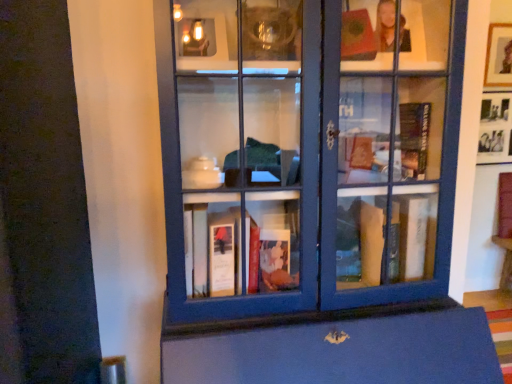
Question: Is wooden picture frame at upper right, the 1th picture frame in the top-to-bottom sequence, looking in the opposite direction of black matte picture frame at upper right, arranged as the first picture frame when ordered from the bottom?

Choices:
 (A) yes
 (B) no

Answer: (B)

Question: Would you say wooden picture frame at upper right, which is counted as the second picture frame, starting from the bottom, is outside black matte picture frame at upper right, arranged as the first picture frame when ordered from the bottom?

Choices:
 (A) yes
 (B) no

Answer: (A)

Question: From the image's perspective, would you say wooden picture frame at upper right, which is counted as the second picture frame, starting from the bottom, is positioned over black matte picture frame at upper right, arranged as the first picture frame when ordered from the bottom?

Choices:
 (A) no
 (B) yes

Answer: (B)

Question: Considering the relative sizes of wooden picture frame at upper right, which is counted as the second picture frame, starting from the bottom, and black matte picture frame at upper right, arranged as the first picture frame when ordered from the bottom, in the image provided, is wooden picture frame at upper right, which is counted as the second picture frame, starting from the bottom, bigger than black matte picture frame at upper right, arranged as the first picture frame when ordered from the bottom,?

Choices:
 (A) yes
 (B) no

Answer: (B)

Question: Is wooden picture frame at upper right, the 1th picture frame in the top-to-bottom sequence, at the left side of black matte picture frame at upper right, arranged as the first picture frame when ordered from the bottom?

Choices:
 (A) yes
 (B) no

Answer: (A)

Question: Is wooden picture frame at upper right, which is counted as the second picture frame, starting from the bottom, behind black matte picture frame at upper right, arranged as the first picture frame when ordered from the bottom?

Choices:
 (A) yes
 (B) no

Answer: (B)

Question: Could wooden picture frame at upper right, the 1th picture frame in the top-to-bottom sequence, be considered to be inside matte blue bookcase at center?

Choices:
 (A) yes
 (B) no

Answer: (B)

Question: From a real-world perspective, is matte blue bookcase at center positioned under wooden picture frame at upper right, which is counted as the second picture frame, starting from the bottom, based on gravity?

Choices:
 (A) yes
 (B) no

Answer: (A)

Question: Does matte blue bookcase at center lie in front of wooden picture frame at upper right, the 1th picture frame in the top-to-bottom sequence?

Choices:
 (A) no
 (B) yes

Answer: (B)

Question: Does matte blue bookcase at center have a lesser width compared to wooden picture frame at upper right, the 1th picture frame in the top-to-bottom sequence?

Choices:
 (A) no
 (B) yes

Answer: (A)

Question: Can you confirm if matte blue bookcase at center is bigger than wooden picture frame at upper right, the 1th picture frame in the top-to-bottom sequence?

Choices:
 (A) yes
 (B) no

Answer: (A)

Question: Can you confirm if matte blue bookcase at center is smaller than wooden picture frame at upper right, which is counted as the second picture frame, starting from the bottom?

Choices:
 (A) no
 (B) yes

Answer: (A)

Question: From the image's perspective, is black matte picture frame at upper right, placed as the 2th picture frame when sorted from top to bottom, over matte blue bookcase at center?

Choices:
 (A) no
 (B) yes

Answer: (B)